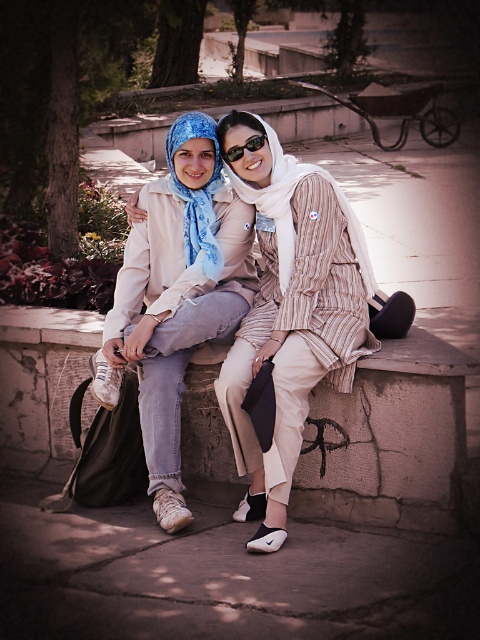
You are a photographer trying to capture a closeup of both the matte beige scarf at center and the blue silk scarf at center. Given that your camera lens has a maximum focus range of 25 inches, will you be able to capture both scarves in focus without adjusting your position?

The matte beige scarf at center is 24.60 inches from the blue silk scarf at center. Since the distance between them is within the camera lens maximum focus range of 25 inches, you can capture both scarves in focus without moving.

You are a photographer trying to capture the matte beige scarf at center in your shot. The camera you are using has a focus point at coordinates 0.5, 0.6. Will the scarf be in focus?

The matte beige scarf at center is at point (289, 316), which is very close to the camera focus point at (288, 320). Therefore, the scarf will be in focus.

You are a photographer trying to capture a closeup shot of the sunglasses at center. You notice the matte beige scarf at center is blocking your view. Can you determine if the scarf is taller than the sunglasses?

The matte beige scarf at center is much taller than sunglasses at center, so it will block the view of the sunglasses at center.